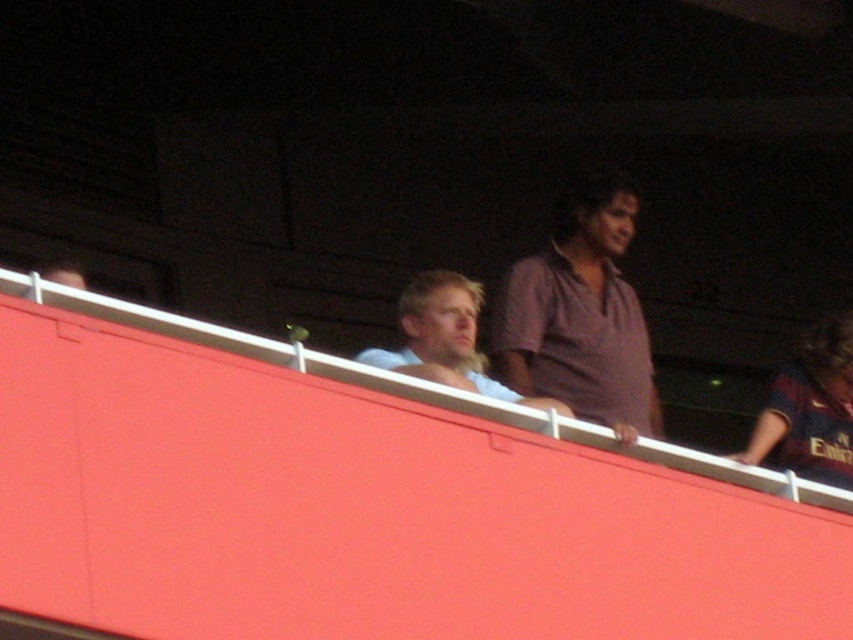
Question: Which object is positioned farthest from the matte jersey at upper right?

Choices:
 (A) light blue shirt at center
 (B) purple cotton shirt at upper right

Answer: (A)

Question: Which is nearer to the light blue shirt at center?

Choices:
 (A) purple cotton shirt at upper right
 (B) matte jersey at upper right

Answer: (A)

Question: Does purple cotton shirt at upper right come behind light blue shirt at center?

Choices:
 (A) no
 (B) yes

Answer: (A)

Question: Does matte jersey at upper right have a smaller size compared to light blue shirt at center?

Choices:
 (A) yes
 (B) no

Answer: (B)

Question: Can you confirm if purple cotton shirt at upper right is smaller than light blue shirt at center?

Choices:
 (A) yes
 (B) no

Answer: (B)

Question: Based on their relative distances, which object is farther from the matte jersey at upper right?

Choices:
 (A) light blue shirt at center
 (B) purple cotton shirt at upper right

Answer: (A)